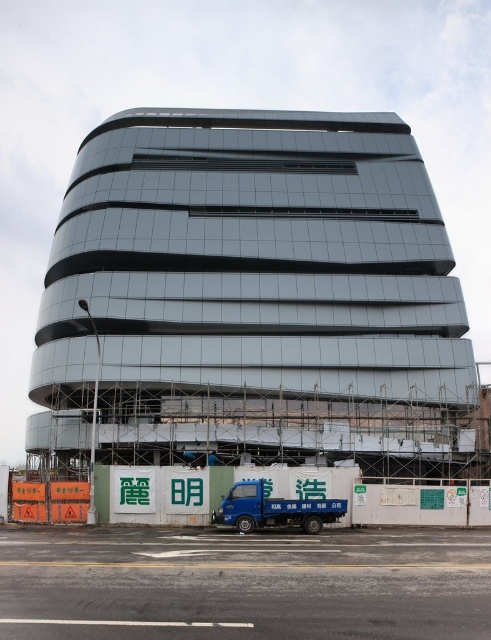
Question: Is glassy metallic building at center below blue metallic truck at lower center?

Choices:
 (A) yes
 (B) no

Answer: (B)

Question: Which object appears farthest from the camera in this image?

Choices:
 (A) blue metallic truck at lower center
 (B) glassy metallic building at center

Answer: (B)

Question: Can you confirm if glassy metallic building at center is positioned below blue metallic truck at lower center?

Choices:
 (A) yes
 (B) no

Answer: (B)

Question: Which of the following is the closest to the observer?

Choices:
 (A) glassy metallic building at center
 (B) blue metallic truck at lower center

Answer: (B)

Question: Is glassy metallic building at center further to the viewer compared to blue metallic truck at lower center?

Choices:
 (A) yes
 (B) no

Answer: (A)